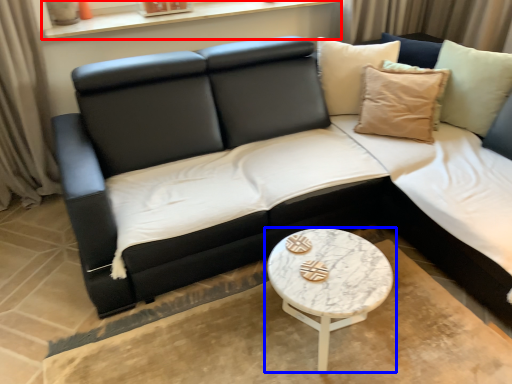
Question: Which of the following is the closest to the observer, window sill (highlighted by a red box) or coffee table (highlighted by a blue box)?

Choices:
 (A) window sill
 (B) coffee table

Answer: (B)